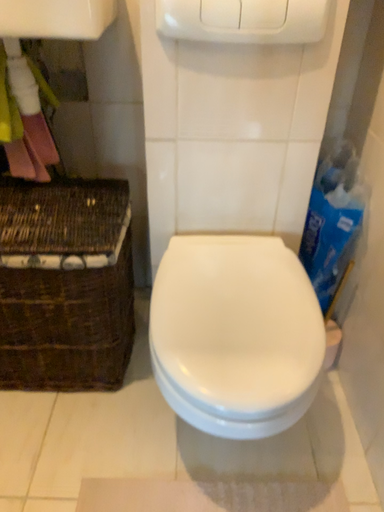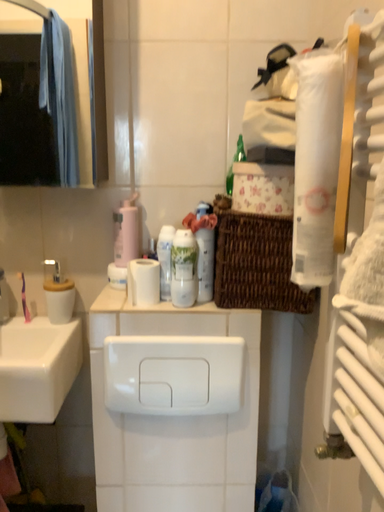
Question: Which way did the camera rotate in the video?

Choices:
 (A) rotated downward
 (B) rotated upward

Answer: (B)